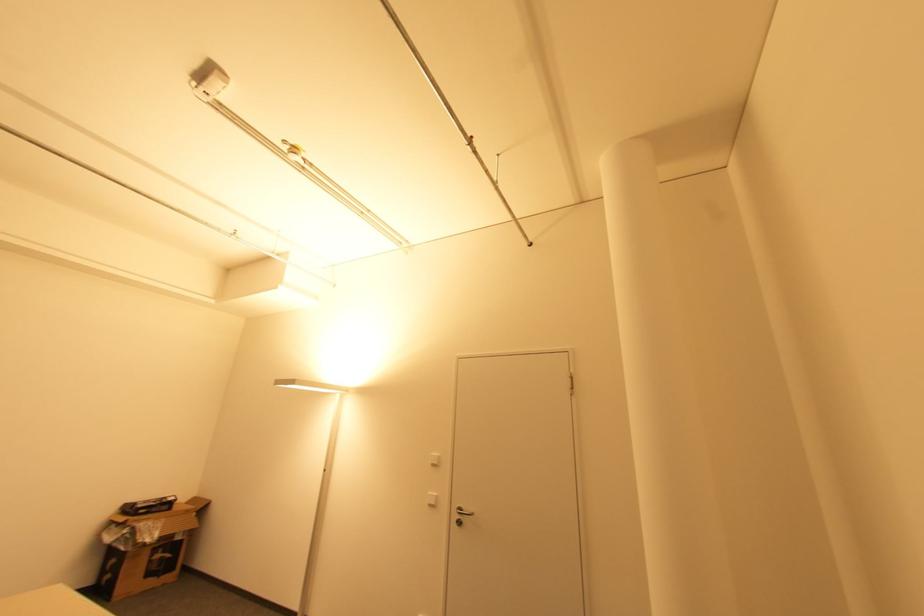
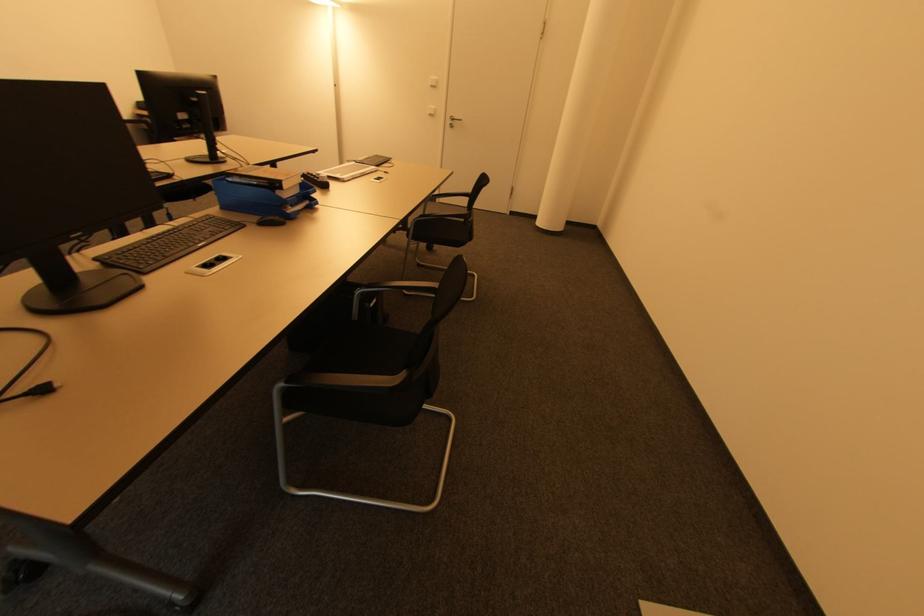
The point at (x=435, y=466) is marked in the first image. Where is the corresponding point in the second image?

(434, 87)